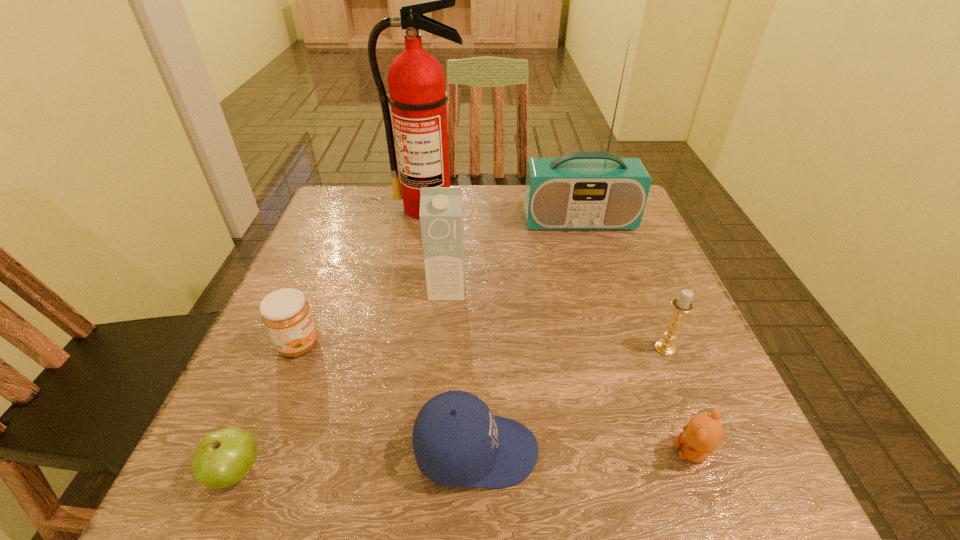
This screenshot has height=540, width=960. I want to click on vacant region between the third tallest object and the teddy bear, so click(x=569, y=370).

I want to click on free point between the fifth shortest object and the fire extinguisher, so 547,278.

Where is `free point between the cap and the teddy bear`? The width and height of the screenshot is (960, 540). free point between the cap and the teddy bear is located at coordinates (585, 451).

Where is `vacant space that is in between the cap and the candle holder`? vacant space that is in between the cap and the candle holder is located at coordinates (571, 400).

Locate an element on the screen. The image size is (960, 540). free space that is in between the candle holder and the fire extinguisher is located at coordinates (547, 278).

I want to click on vacant region between the jam and the cap, so click(x=388, y=398).

What are the coordinates of `the third closest object to the fire extinguisher` in the screenshot? It's located at (x=286, y=314).

Locate which object ranks third in proximity to the seventh shortest object. Please provide its 2D coordinates. Your answer should be formatted as a tuple, i.e. [(x, y)], where the tuple contains the x and y coordinates of a point satisfying the conditions above.

[(682, 305)]

Where is `free space that satisfies the following two spatial constraints: 1. on the side of the fire extinguisher near the handle; 2. on the front label of the jam`? free space that satisfies the following two spatial constraints: 1. on the side of the fire extinguisher near the handle; 2. on the front label of the jam is located at coordinates (406, 345).

At what (x,y) coordinates should I click in order to perform the action: click on vacant space that satisfies the following two spatial constraints: 1. on the front panel of the radio receiver; 2. on the front label of the jam. Please return your answer as a coordinate pair (x, y). Image resolution: width=960 pixels, height=540 pixels. Looking at the image, I should click on (616, 345).